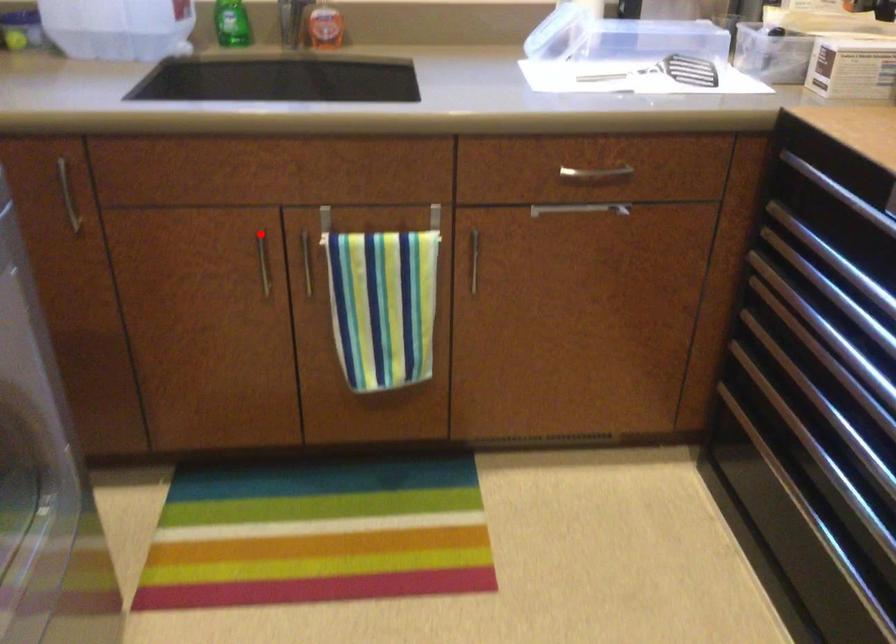
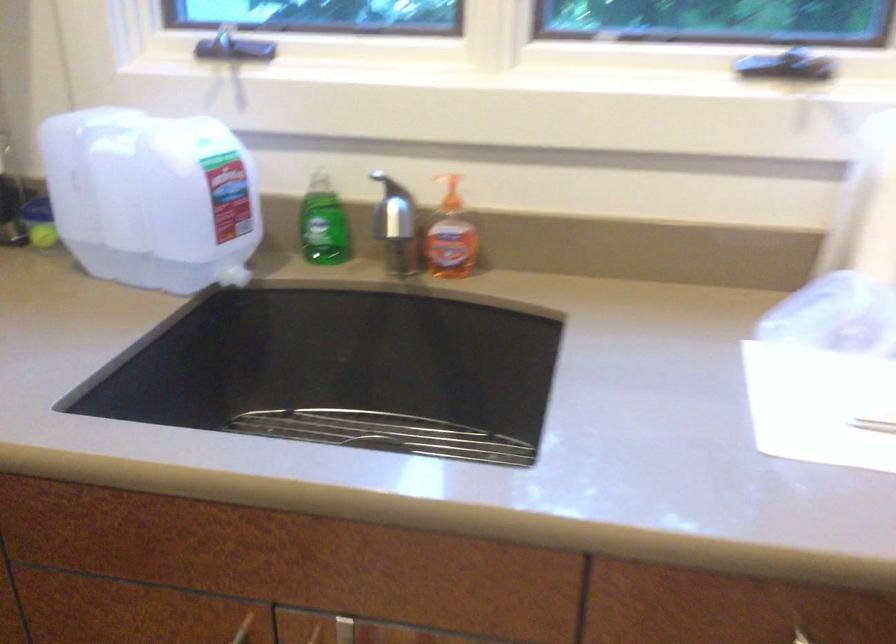
Question: I am providing you with two images of the same scene from different viewpoints. A red point is shown in image1. For the corresponding object point in image2, is it positioned nearer or farther from the camera?

Choices:
 (A) Nearer
 (B) Farther

Answer: (A)